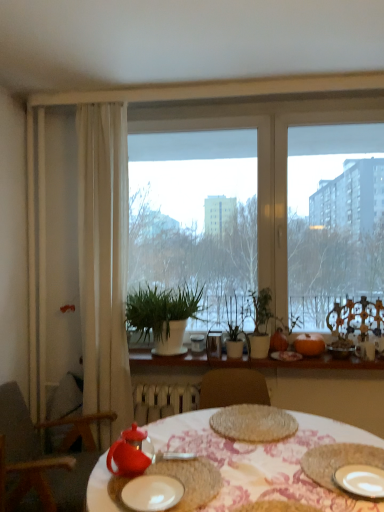
Question: Are white ceramic plate at lower right, the second plate positioned from the left, and white matte plant pot at center located far from each other?

Choices:
 (A) yes
 (B) no

Answer: (A)

Question: Is white ceramic plate at lower right, the second plate positioned from the left, directly adjacent to white matte plant pot at center?

Choices:
 (A) yes
 (B) no

Answer: (B)

Question: Is white ceramic plate at lower right, placed as the first plate when sorted from right to left, aimed at white matte plant pot at center?

Choices:
 (A) no
 (B) yes

Answer: (A)

Question: Is white ceramic plate at lower right, placed as the first plate when sorted from right to left, at the left side of white matte plant pot at center?

Choices:
 (A) yes
 (B) no

Answer: (B)

Question: From a real-world perspective, is white ceramic plate at lower right, placed as the first plate when sorted from right to left, physically below white matte plant pot at center?

Choices:
 (A) no
 (B) yes

Answer: (B)

Question: Choose the correct answer: Is matte red teapot at lower center, placed as the 1th tableware when sorted from left to right, inside wooden chair at left or outside it?

Choices:
 (A) inside
 (B) outside

Answer: (B)

Question: Relative to wooden chair at left, is matte red teapot at lower center, the fourth tableware in the back-to-front sequence, in front or behind?

Choices:
 (A) front
 (B) behind

Answer: (A)

Question: Considering the positions of point tap(127, 442) and point tap(9, 418), is point tap(127, 442) closer or farther from the camera than point tap(9, 418)?

Choices:
 (A) closer
 (B) farther

Answer: (A)

Question: Looking at their shapes, would you say matte red teapot at lower center, placed as the 1th tableware when sorted from left to right, is wider or thinner than wooden chair at left?

Choices:
 (A) thin
 (B) wide

Answer: (A)

Question: Considering the positions of white sheer curtain at left and rustic woven placemat at lower right in the image, is white sheer curtain at left taller or shorter than rustic woven placemat at lower right?

Choices:
 (A) tall
 (B) short

Answer: (A)

Question: From a real-world perspective, is white sheer curtain at left positioned above or below rustic woven placemat at lower right?

Choices:
 (A) below
 (B) above

Answer: (B)

Question: Relative to rustic woven placemat at lower right, is white sheer curtain at left in front or behind?

Choices:
 (A) behind
 (B) front

Answer: (A)

Question: Considering the positions of white sheer curtain at left and rustic woven placemat at lower right in the image, is white sheer curtain at left wider or thinner than rustic woven placemat at lower right?

Choices:
 (A) thin
 (B) wide

Answer: (A)

Question: From a real-world perspective, is white matte plant pot at center positioned above or below woven mat at center?

Choices:
 (A) above
 (B) below

Answer: (A)

Question: Is white matte plant pot at center spatially inside woven mat at center, or outside of it?

Choices:
 (A) inside
 (B) outside

Answer: (B)